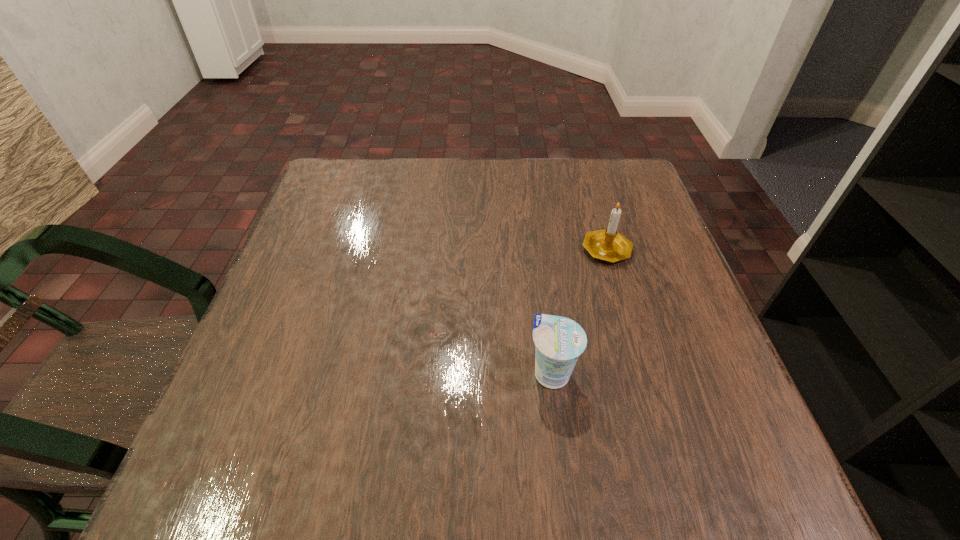
Where is `the farther object`? This screenshot has height=540, width=960. the farther object is located at coordinates (608, 244).

Identify the location of the taller object. This screenshot has height=540, width=960. (608, 244).

At what (x,y) coordinates should I click in order to perform the action: click on yogurt. Please return your answer as a coordinate pair (x, y). Image resolution: width=960 pixels, height=540 pixels. Looking at the image, I should click on (559, 341).

Find the location of a particular element. the nearer object is located at coordinates (559, 341).

Identify the location of vacant space located 0.270m on the left of the right object. (458, 248).

Find the location of a particular element. The height and width of the screenshot is (540, 960). vacant space positioned on the left of the shorter object is located at coordinates (469, 373).

At what (x,y) coordinates should I click in order to perform the action: click on object that is positioned at the right edge. Please return your answer as a coordinate pair (x, y). Image resolution: width=960 pixels, height=540 pixels. Looking at the image, I should click on (608, 244).

This screenshot has width=960, height=540. In the image, there is a desktop. Find the location of `vacant space at the far edge`. vacant space at the far edge is located at coordinates pos(390,195).

Where is `free point at the near edge`? The image size is (960, 540). free point at the near edge is located at coordinates (636, 458).

This screenshot has height=540, width=960. In order to click on blank space at the left edge in this screenshot , I will do `click(355, 234)`.